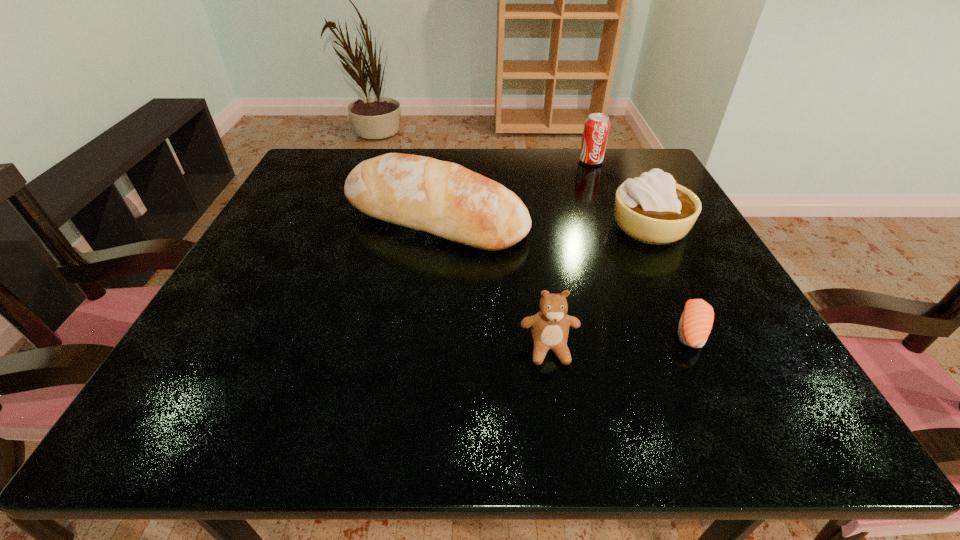
I want to click on bread that is at the far edge, so click(445, 199).

This screenshot has width=960, height=540. Find the location of `soda can at the far edge`. soda can at the far edge is located at coordinates (596, 129).

I want to click on object that is positioned at the left edge, so click(x=445, y=199).

Locate an element on the screen. Image resolution: width=960 pixels, height=540 pixels. whipped cream at the right edge is located at coordinates (654, 209).

Find the location of a particular element. The image size is (960, 540). soda can at the right edge is located at coordinates (596, 129).

The image size is (960, 540). What are the coordinates of `sushi situated at the right edge` in the screenshot? It's located at (696, 322).

Locate an element on the screen. object at the far left corner is located at coordinates (445, 199).

Where is `object situated at the far right corner`? object situated at the far right corner is located at coordinates (596, 129).

The height and width of the screenshot is (540, 960). In order to click on free space at the far edge in this screenshot , I will do `click(510, 167)`.

In the image, there is a desktop. Identify the location of free space at the left edge. tap(285, 222).